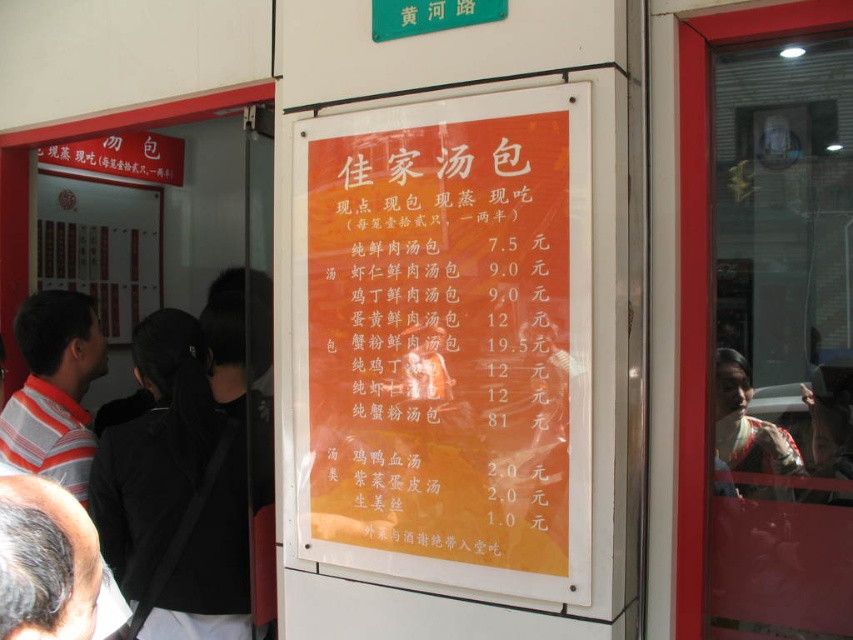
You are a customer at the food stall and want to order the most expensive baozi. You see the orange paper menu at center and the striped cotton shirt at left. Which item is larger?

The orange paper menu at center is bigger than the striped cotton shirt at left, so the orange paper menu at center is larger.

You are a customer standing in front of the food stall and want to read the orange paper menu at center. The striped cotton shirt at left is blocking your view. Which direction should you move to see the menu clearly?

The orange paper menu at center is positioned on the right side of striped cotton shirt at left. To see the menu clearly, you should move to the right side of the striped cotton shirt at left.